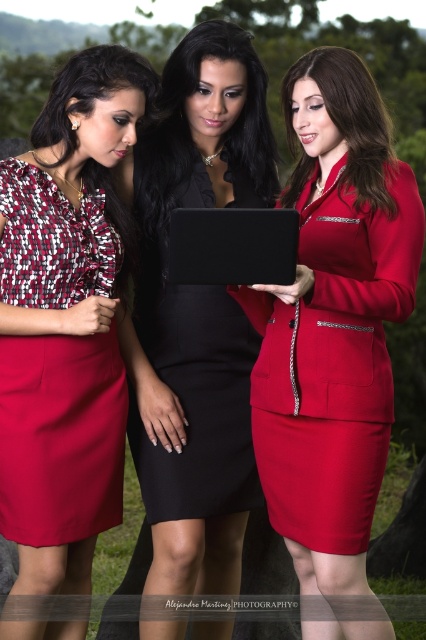
You are a delivery person who needs to place a matte black tablet at center and a black matte tablet at center into a box that can only hold items within 12 inches of each other. Can both items fit in the box?

The matte black tablet at center is 11.59 inches from black matte tablet at center, which is under the 12 inches limit, so both items can fit in the box.